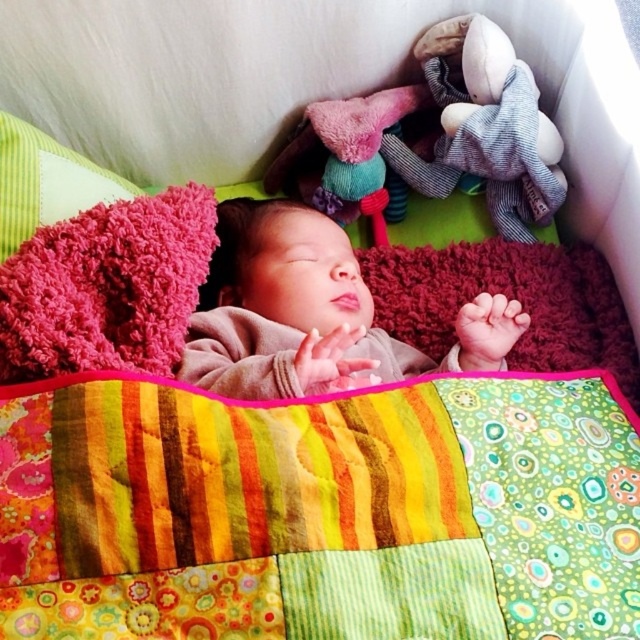
Measure the distance from multicolored patchwork quilt at center to fuzzy pink pillow at upper left.

They are 19.43 inches apart.

Consider the image. Is multicolored patchwork quilt at center taller than fuzzy pink pillow at upper left?

Yes.

Does point (467, 621) lie in front of point (65, 202)?

Yes, point (467, 621) is in front of point (65, 202).

What are the coordinates of `multicolored patchwork quilt at center` in the screenshot? It's located at (321, 509).

Is point (124, 483) closer to viewer compared to point (275, 241)?

Yes, point (124, 483) is closer to viewer.

Between point (625, 484) and point (305, 326), which one is positioned behind?

The point (305, 326) is behind.

What are the coordinates of `multicolored patchwork quilt at center` in the screenshot? It's located at (321, 509).

Between soft pink blanket at center and soft plush toy at upper right, which one has more height?

Standing taller between the two is soft plush toy at upper right.

Between point (333, 378) and point (420, 176), which one is positioned in front?

Positioned in front is point (333, 378).

Locate an element on the screen. This screenshot has width=640, height=640. soft pink blanket at center is located at coordinates (310, 312).